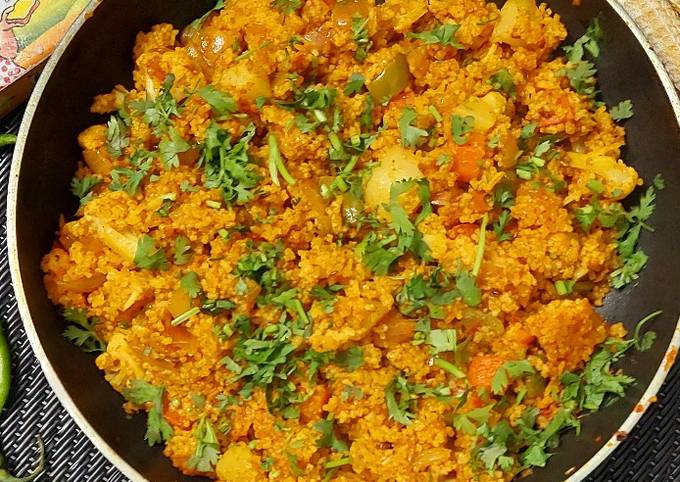
The height and width of the screenshot is (482, 680). In order to click on bowl in this screenshot , I will do `click(657, 259)`.